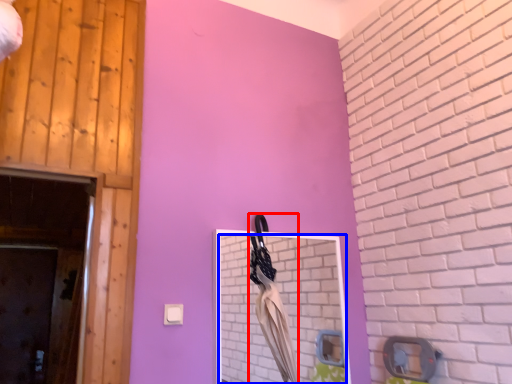
Question: Which object appears farthest to the camera in this image, laundry (highlighted by a red box) or mirror (highlighted by a blue box)?

Choices:
 (A) laundry
 (B) mirror

Answer: (A)